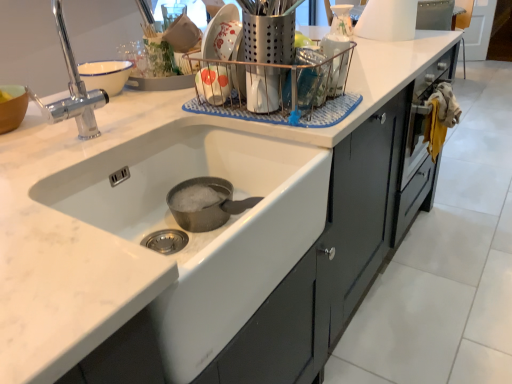
Question: Which is correct: white glossy sink at center is inside satin silver utensil holder at upper center, acting as the first appliance starting from the left, or outside of it?

Choices:
 (A) inside
 (B) outside

Answer: (B)

Question: In terms of size, does white glossy sink at center appear bigger or smaller than satin silver utensil holder at upper center, acting as the first appliance starting from the left?

Choices:
 (A) big
 (B) small

Answer: (A)

Question: Which object is positioned farthest from the white glossy sink at center?

Choices:
 (A) clear plastic container at upper center, the second appliance in the left-to-right sequence
 (B) white glossy coffee pot at upper center, the first appliance when ordered from back to front
 (C) satin silver utensil holder at upper center, the first appliance positioned from the front
 (D) white glossy paper towel dispenser at upper right, placed as the 1th appliance when sorted from right to left

Answer: (B)

Question: Which object is the farthest from the clear plastic container at upper center, the second appliance in the left-to-right sequence?

Choices:
 (A) white glossy sink at center
 (B) white glossy paper towel dispenser at upper right, which is the fourth appliance from left to right
 (C) white glossy coffee pot at upper center, the second appliance in the right-to-left sequence
 (D) satin silver utensil holder at upper center, acting as the first appliance starting from the left

Answer: (C)